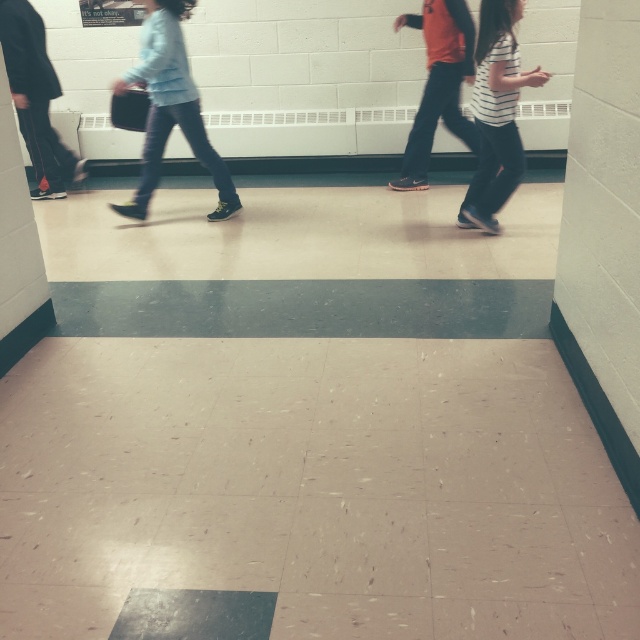
You are a student in the hallway and need to decide which direction to go. You notice a light blue denim jacket at upper left and a white striped shirt at center. Which clothing item is wider?

The light blue denim jacket at upper left is wider than the white striped shirt at center.

You are a student in the hallway and want to know if the light blue denim jacket at upper left is wider than the orange fabric shirt at center. Can you confirm this based on the scene?

The light blue denim jacket at upper left might be wider than orange fabric shirt at center according to the scene description.

You are standing in the school hallway shown. You see two people wearing shirts labeled as the white striped shirt at center and orange fabric shirt at center. Which shirt is positioned lower in the image?

The white striped shirt at center is below orange fabric shirt at center, so the white striped shirt at center is positioned lower in the image.